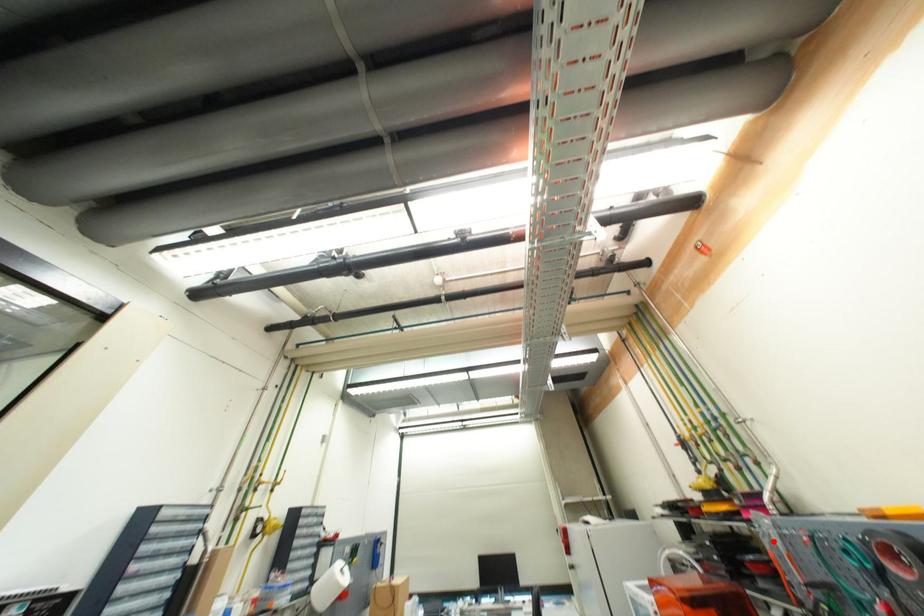
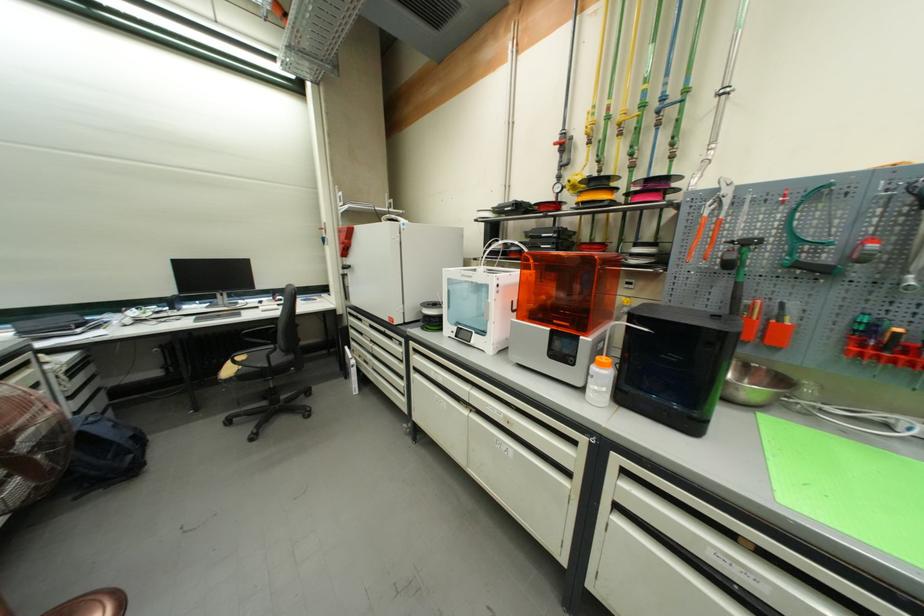
Where in the second image is the point corresponding to the highlighted location from the first image?

(719, 208)